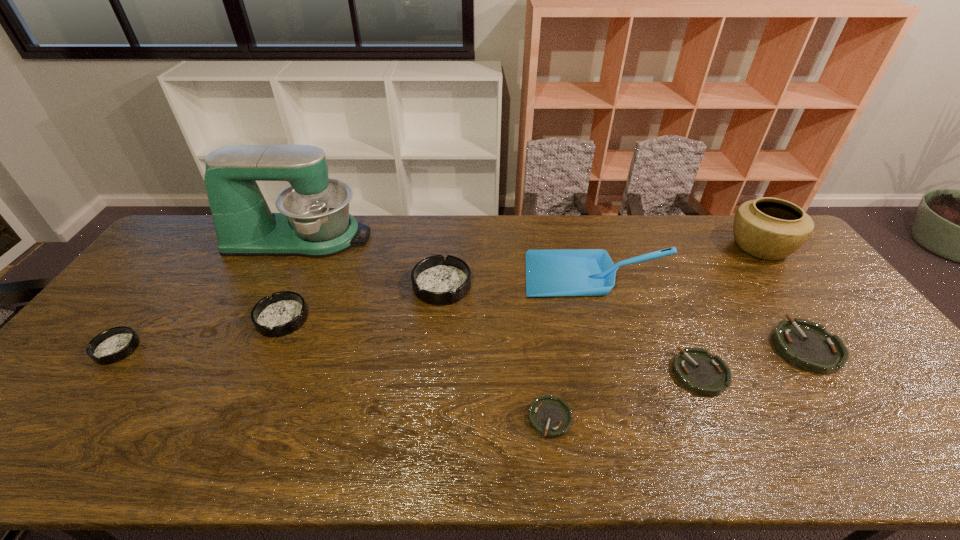
Where is `the tallest object`? the tallest object is located at coordinates (314, 221).

Locate an element on the screen. pottery is located at coordinates (768, 228).

At what (x,y) coordinates should I click in order to perform the action: click on the seventh shortest object. Please return your answer as a coordinate pair (x, y). The width and height of the screenshot is (960, 540). Looking at the image, I should click on (570, 272).

At what (x,y) coordinates should I click in order to perform the action: click on the rightmost dark ashtray. Please return your answer as a coordinate pair (x, y). This screenshot has width=960, height=540. Looking at the image, I should click on (437, 280).

The width and height of the screenshot is (960, 540). In order to click on the fourth tallest object in this screenshot , I will do `click(437, 280)`.

At what (x,y) coordinates should I click in order to perform the action: click on the fifth shortest ashtray. Please return your answer as a coordinate pair (x, y). This screenshot has width=960, height=540. Looking at the image, I should click on (284, 312).

At what (x,y) coordinates should I click in order to perform the action: click on the fifth ashtray from right to left. Please return your answer as a coordinate pair (x, y). Looking at the image, I should click on (284, 312).

Find the location of `the biggest green ashtray`. the biggest green ashtray is located at coordinates (807, 345).

Locate an element on the screen. Image resolution: width=960 pixels, height=540 pixels. the rightmost green ashtray is located at coordinates (807, 345).

This screenshot has height=540, width=960. Find the location of `the leftmost dark ashtray`. the leftmost dark ashtray is located at coordinates (115, 344).